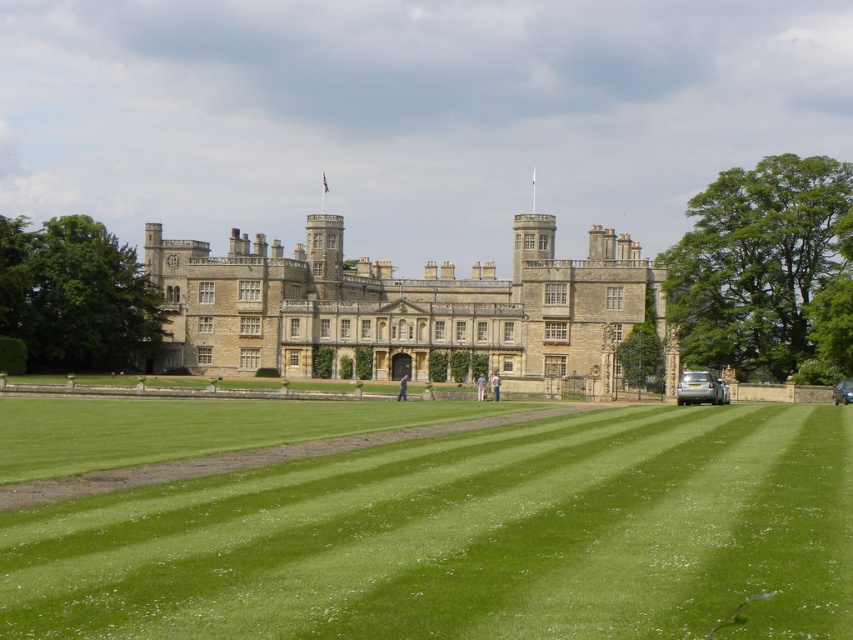
Question: Observing the image, what is the correct spatial positioning of green grass at center in reference to light brown leather jacket at center?

Choices:
 (A) left
 (B) right

Answer: (B)

Question: Is green grass at center smaller than beige stone castle at center?

Choices:
 (A) yes
 (B) no

Answer: (A)

Question: Is green grass at center behind light brown leather jacket at center?

Choices:
 (A) no
 (B) yes

Answer: (A)

Question: Which object appears farthest from the camera in this image?

Choices:
 (A) blue fabric person at center
 (B) beige stone castle at center
 (C) green grass at center
 (D) light blue fabric shirt at center

Answer: (A)

Question: Among these points, which one is farthest from the camera?

Choices:
 (A) (404, 376)
 (B) (637, 252)

Answer: (B)

Question: Among these objects, which one is nearest to the camera?

Choices:
 (A) light brown leather jacket at center
 (B) light blue fabric shirt at center
 (C) blue fabric person at center

Answer: (A)